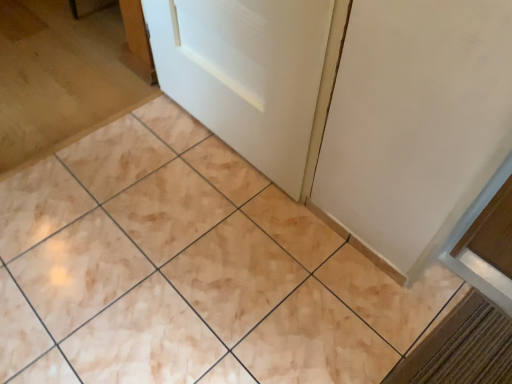
Question: Considering the positions of white glossy door at upper center and beige marble tile at center in the image, is white glossy door at upper center bigger or smaller than beige marble tile at center?

Choices:
 (A) small
 (B) big

Answer: (A)

Question: Is point (288, 92) positioned closer to the camera than point (7, 185)?

Choices:
 (A) farther
 (B) closer

Answer: (B)

Question: From their relative heights in the image, would you say white glossy door at upper center is taller or shorter than beige marble tile at center?

Choices:
 (A) short
 (B) tall

Answer: (B)

Question: Is point (136, 322) closer or farther from the camera than point (288, 130)?

Choices:
 (A) closer
 (B) farther

Answer: (A)

Question: Considering the positions of beige marble tile at center and white glossy door at upper center in the image, is beige marble tile at center wider or thinner than white glossy door at upper center?

Choices:
 (A) wide
 (B) thin

Answer: (A)

Question: From the image's perspective, is beige marble tile at center located above or below white glossy door at upper center?

Choices:
 (A) below
 (B) above

Answer: (A)

Question: Choose the correct answer: Is beige marble tile at center inside white glossy door at upper center or outside it?

Choices:
 (A) outside
 (B) inside

Answer: (A)